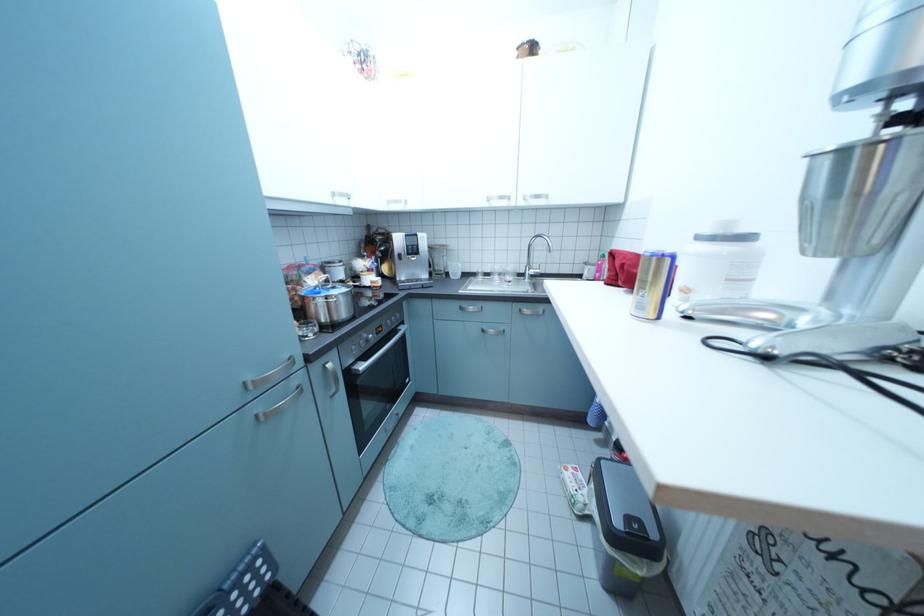
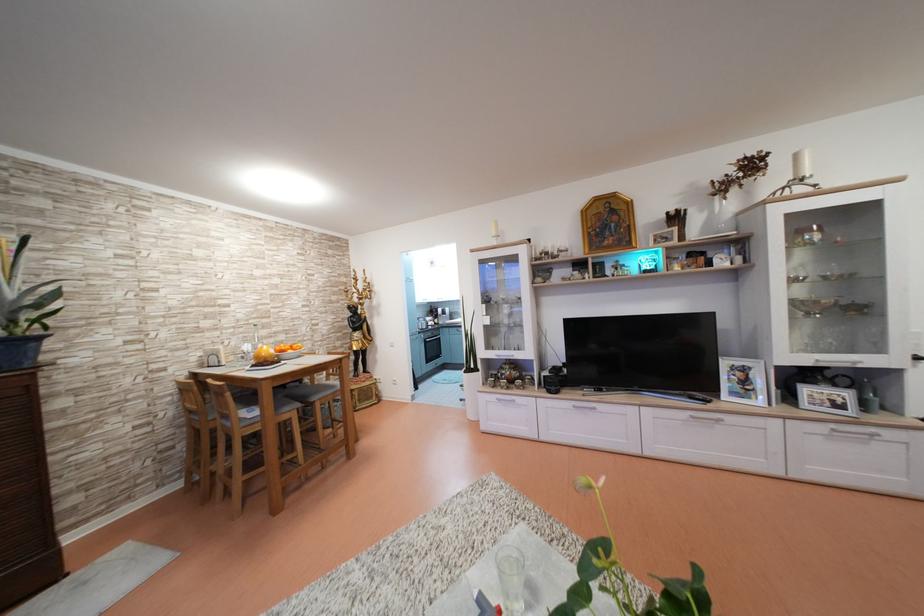
What movement of the cameraman would produce the second image?

The cameraman moved toward right, backward.